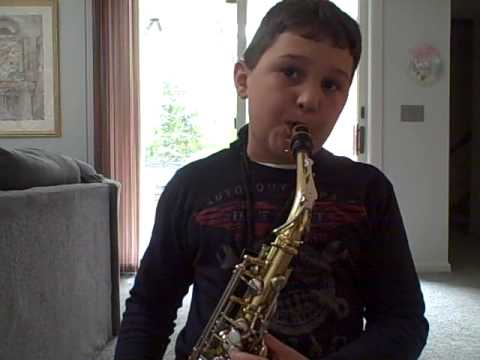
This screenshot has height=360, width=480. Identify the location of carpet. (456, 297).